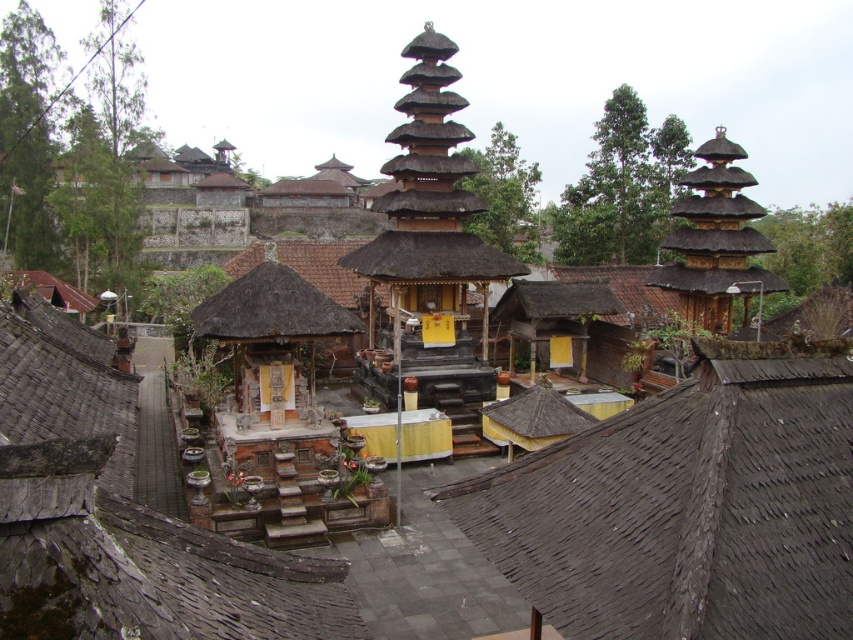
Is brown thatched roof at center wider than thatched wood tower at center?

No.

Is brown thatched roof at center taller than thatched wood tower at center?

No, brown thatched roof at center is not taller than thatched wood tower at center.

Measure the distance between brown thatched roof at center and camera.

13.62 meters

Where is `brown thatched roof at center`? brown thatched roof at center is located at coordinates (688, 506).